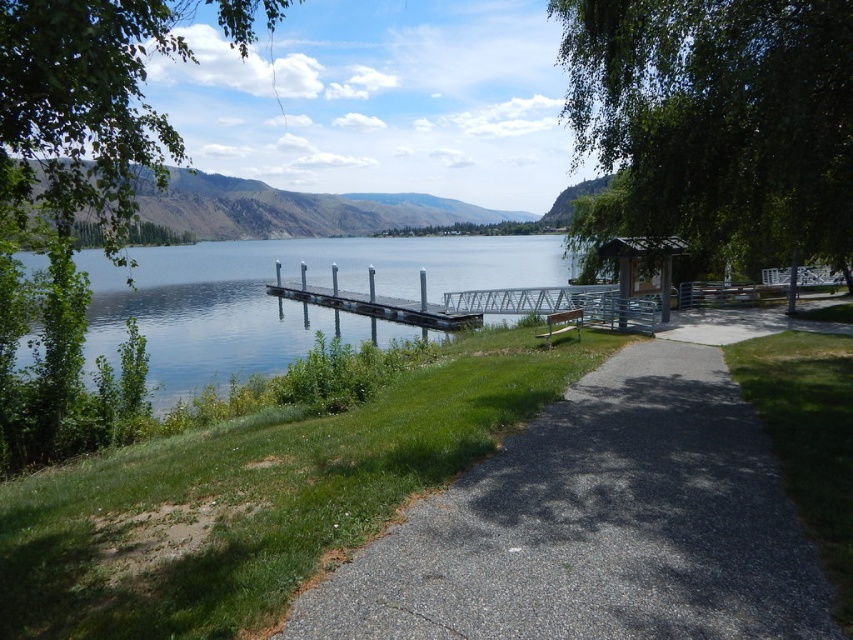
Question: Based on their relative distances, which object is farther from the gray asphalt path at center?

Choices:
 (A) clear water at dock left
 (B) metallic silver bench at lower center
 (C) metallic gray dock at center

Answer: (A)

Question: Considering the relative positions of green leafy tree at upper right and clear water at dock left in the image provided, where is green leafy tree at upper right located with respect to clear water at dock left?

Choices:
 (A) left
 (B) right

Answer: (B)

Question: Does green leafy tree at upper right come in front of metallic silver bench at lower center?

Choices:
 (A) no
 (B) yes

Answer: (B)

Question: Based on their relative distances, which object is nearer to the metallic silver bench at lower center?

Choices:
 (A) clear water at dock left
 (B) green leafy tree at upper right
 (C) gray asphalt path at center

Answer: (B)

Question: Which of the following is the farthest from the observer?

Choices:
 (A) (506, 234)
 (B) (164, 365)
 (C) (410, 324)
 (D) (659, 65)

Answer: (A)

Question: Considering the relative positions of green leafy tree at left and metallic silver bench at lower center in the image provided, where is green leafy tree at left located with respect to metallic silver bench at lower center?

Choices:
 (A) below
 (B) above

Answer: (B)